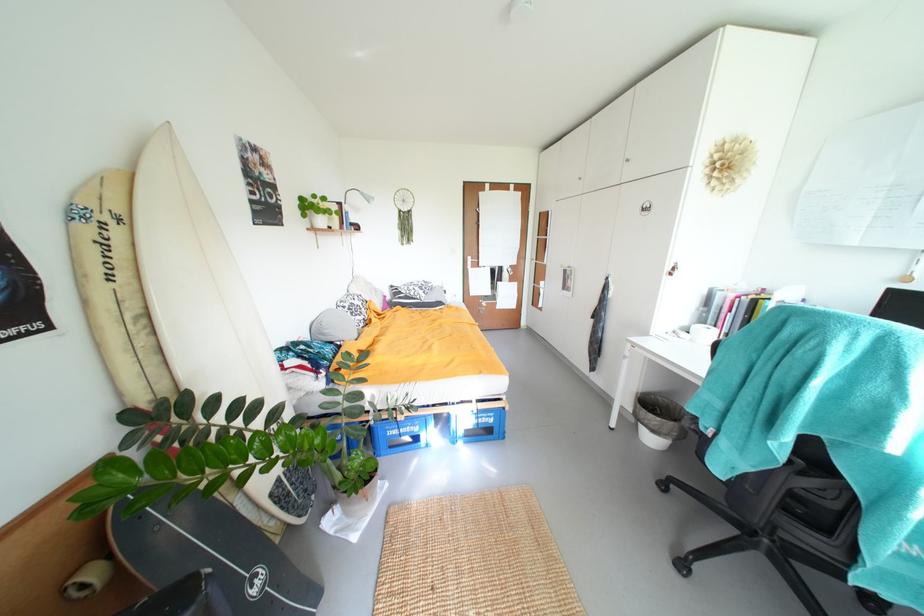
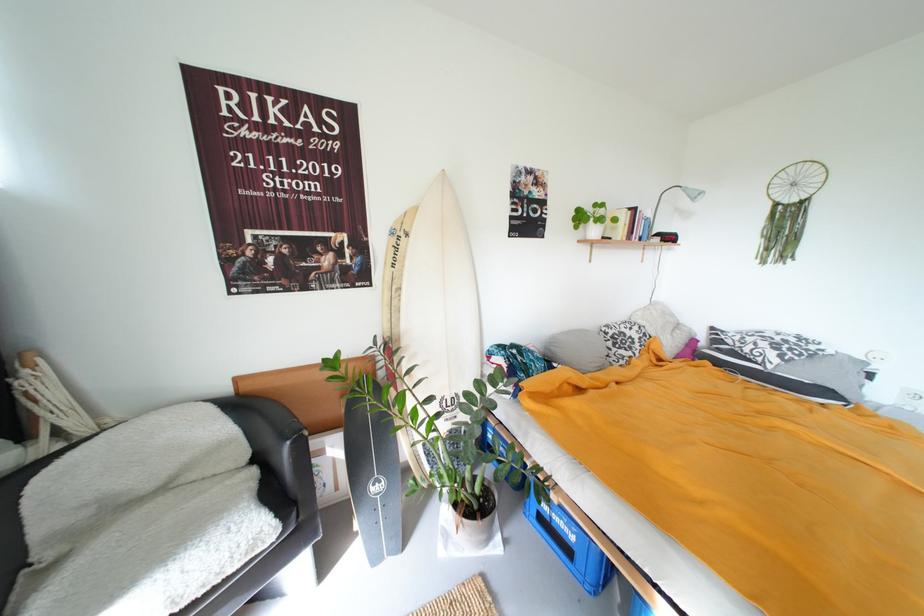
Question: I am providing you with two images of the same scene from different viewpoints. Please identify which objects are invisible in image2.

Choices:
 (A) chair sitting surface
 (B) white surfboard
 (C) digital clock
 (D) none of these

Answer: (D)